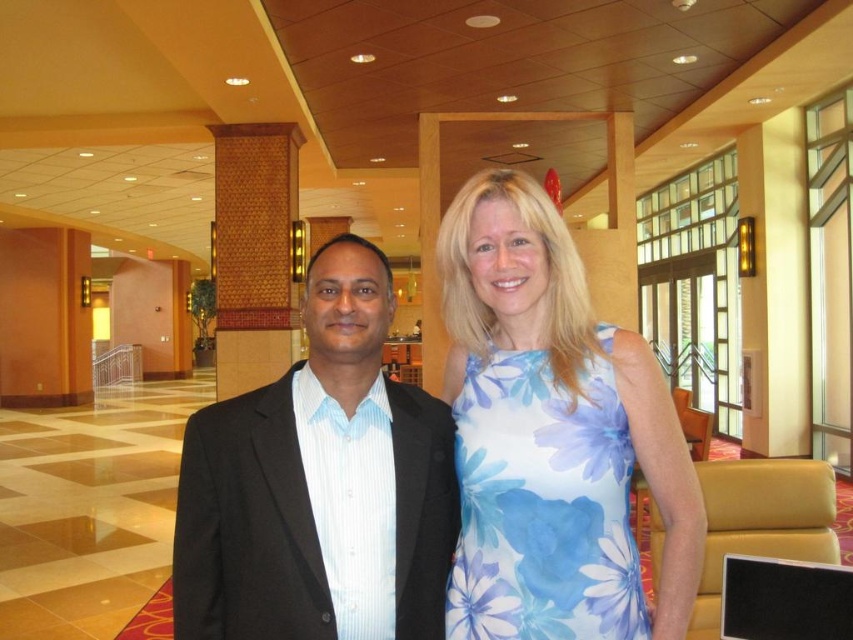
You are standing in the hotel lobby and want to take a photo of the blue floral dress at center. The camera you are using has a focus point at coordinate point (x=552, y=435). Will this point be on the blue floral dress at center?

Yes, the point (x=552, y=435) is on the blue floral dress at center, so the focus point will be on the dress.

You are a photographer setting up for a group photo. You need to ensure that both the blue floral dress at center and the black matte suit at center are clearly visible. Given their sizes, which one should you focus on first to ensure proper framing?

The blue floral dress at center is larger in size than the black matte suit at center, so you should focus on framing the blue floral dress at center first to ensure it fits well within the composition.